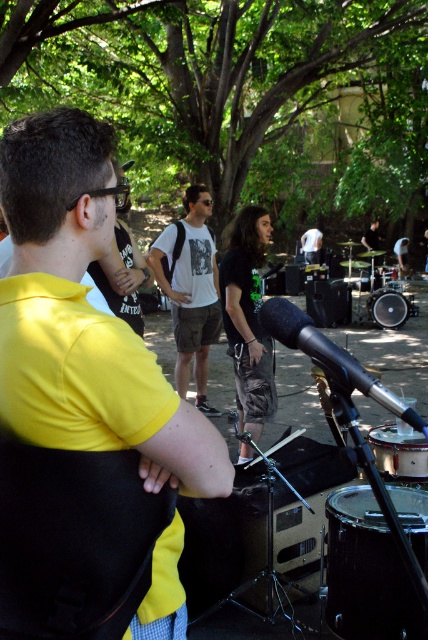
Question: Which of the following is the farthest from the observer?

Choices:
 (A) black drum at center
 (B) yellow matte shirt at center
 (C) white cotton t-shirt at center

Answer: (A)

Question: Which point is farther to the camera?

Choices:
 (A) white cotton t-shirt at center
 (B) brushed metal drum at center

Answer: (A)

Question: Does white cotton t-shirt at center have a lesser width compared to brushed metal drum at center?

Choices:
 (A) yes
 (B) no

Answer: (B)

Question: Which object appears closest to the camera in this image?

Choices:
 (A) brushed metal drum at center
 (B) black drum at center
 (C) shiny black drum at lower right
 (D) green camouflage pants at center

Answer: (C)

Question: Does yellow matte shirt at center have a greater width compared to black drum at center?

Choices:
 (A) no
 (B) yes

Answer: (A)

Question: Is yellow matte shirt at center wider than brushed metal drum at center?

Choices:
 (A) yes
 (B) no

Answer: (A)